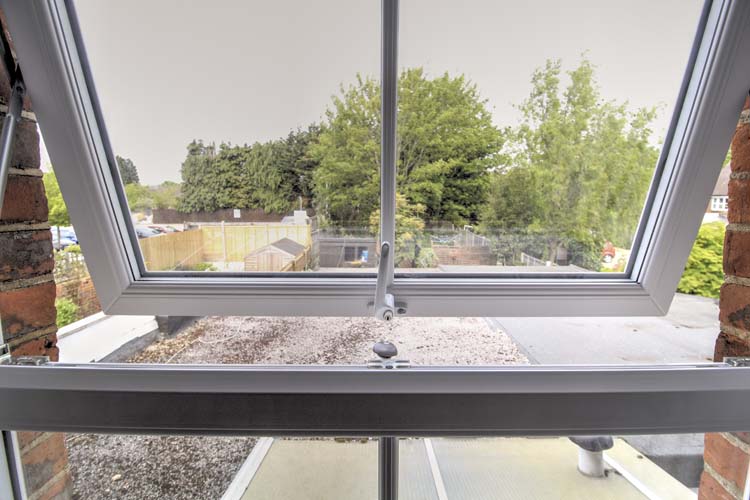
The height and width of the screenshot is (500, 750). Identify the location of glass of window. (628, 161), (296, 157), (279, 475), (486, 464).